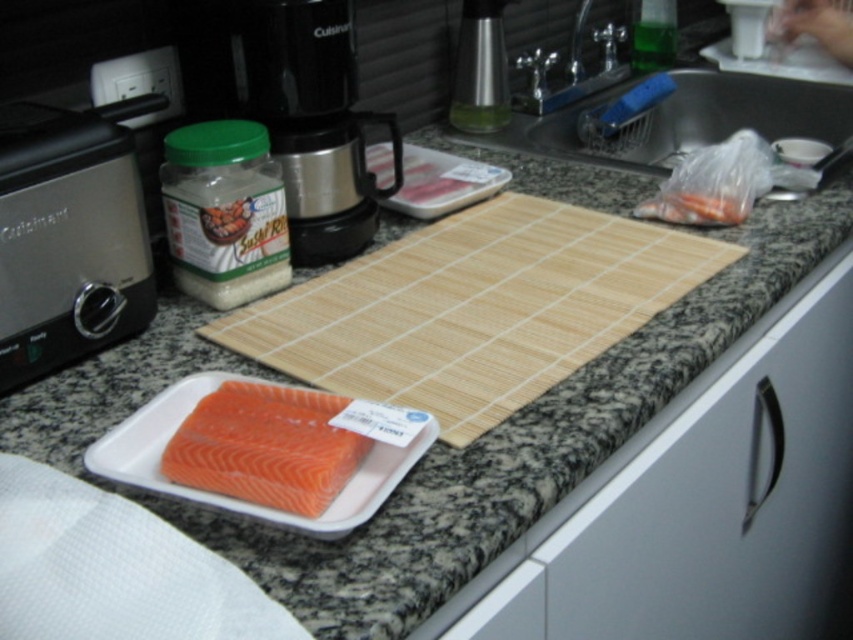
Question: Based on their relative distances, which object is farther from the white matte drawer at lower right?

Choices:
 (A) metallic sink at upper right
 (B) satin silver toaster at left

Answer: (B)

Question: Which is nearer to the metallic sink at upper right?

Choices:
 (A) satin silver toaster at left
 (B) translucent plastic carrots at upper right
 (C) pink fleshed salmon at center

Answer: (B)

Question: Which object is the closest to the black plastic coffee machine at upper center?

Choices:
 (A) metallic sink at upper right
 (B) translucent plastic carrots at upper right

Answer: (B)

Question: Is black plastic coffee machine at upper center wider than pink fleshed salmon at center?

Choices:
 (A) no
 (B) yes

Answer: (B)

Question: Can you confirm if white matte drawer at lower right is smaller than pink fleshed salmon at center?

Choices:
 (A) yes
 (B) no

Answer: (B)

Question: Can you confirm if black plastic coffee machine at upper center is positioned above pink fleshed salmon at center?

Choices:
 (A) no
 (B) yes

Answer: (B)